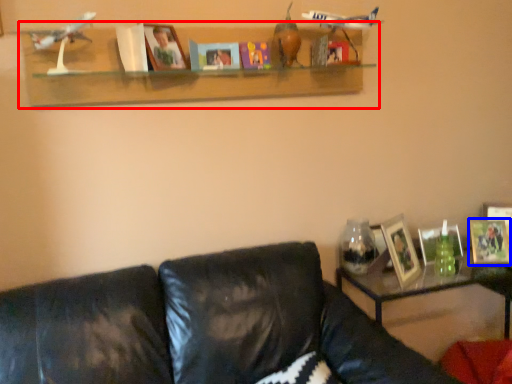
Question: Which object is closer to the camera taking this photo, shelf (highlighted by a red box) or picture frame (highlighted by a blue box)?

Choices:
 (A) shelf
 (B) picture frame

Answer: (A)